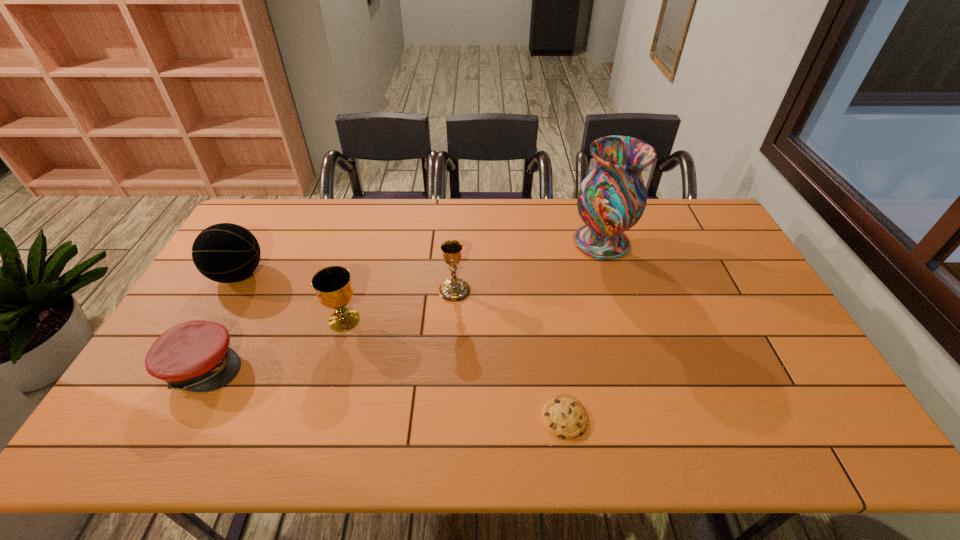
Identify the location of free space between the fourth farthest object and the second object from right to left. The height and width of the screenshot is (540, 960). (454, 369).

Identify the location of unoccupied area between the cap and the rightmost object. click(402, 304).

Locate an element on the screen. This screenshot has width=960, height=540. free area in between the fifth object from left to right and the rightmost object is located at coordinates (583, 330).

Identify the location of free space between the cookie and the basketball. (401, 346).

Identify the location of the third closest object to the second shortest object. The image size is (960, 540). (453, 289).

Identify which object is the fifth nearest to the second object from right to left. Please provide its 2D coordinates. Your answer should be formatted as a tuple, i.e. [(x, y)], where the tuple contains the x and y coordinates of a point satisfying the conditions above.

[(226, 253)]

This screenshot has height=540, width=960. Find the location of `free region that satisfies the following two spatial constraints: 1. on the front side of the fifth object from left to right; 2. on the left side of the basketball`. free region that satisfies the following two spatial constraints: 1. on the front side of the fifth object from left to right; 2. on the left side of the basketball is located at coordinates (157, 417).

At what (x,y) coordinates should I click in order to perform the action: click on blank area in the image that satisfies the following two spatial constraints: 1. on the front of the shortest object with an emblem; 2. on the right side of the fifth tallest object. Please return your answer as a coordinate pair (x, y). This screenshot has height=540, width=960. Looking at the image, I should click on (176, 417).